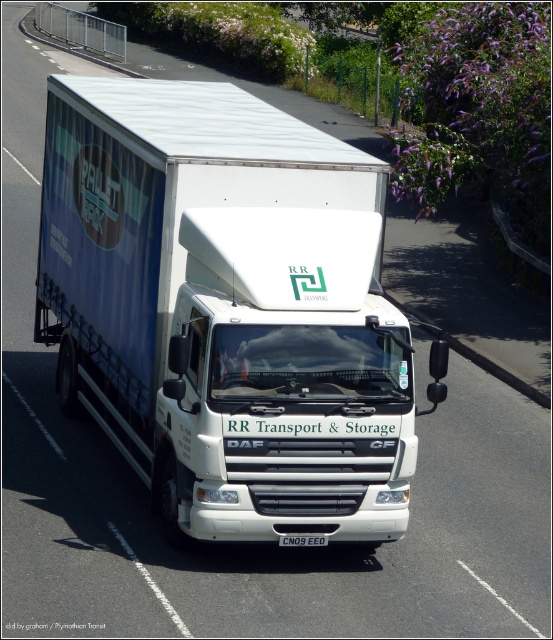
Looking at this image, you are a driver who needs to check the license plate of the white matte truck at center. Since the truck is moving, you can only glance at it quickly. Based on the image, can you tell if the black plastic license plate at center is positioned to the left or right side of the truck?

The white matte truck at center is to the right of the black plastic license plate at center, so the license plate is positioned to the left side of the truck.

You are a photographer trying to capture the white matte truck at center and the black plastic license plate at center in a single frame. Since you want to ensure both are clearly visible, which object should you focus on first to account for their size difference?

The white matte truck at center is taller than the black plastic license plate at center, so you should focus on the white matte truck at center first to ensure its details are sharp before adjusting for the smaller license plate.